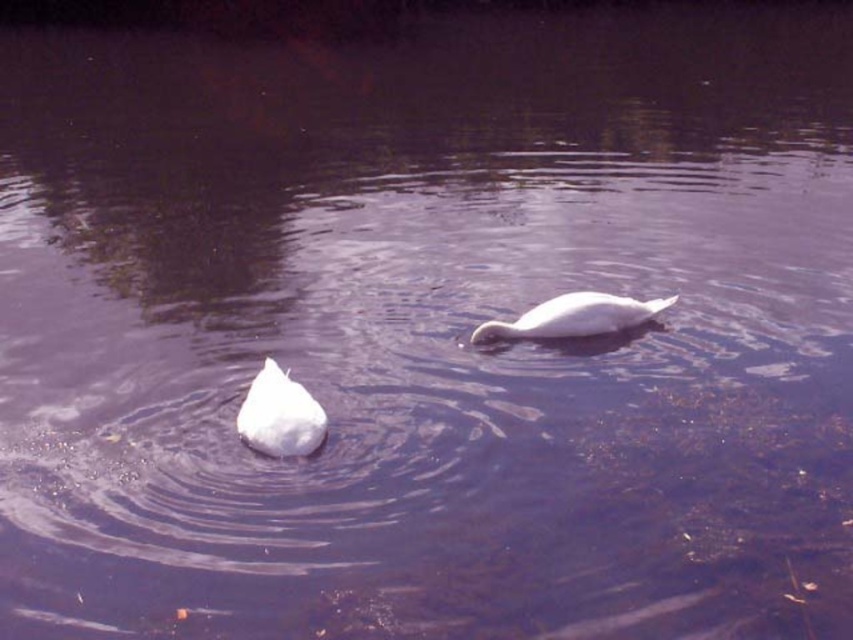
Between white matte swan at lower left and white glossy swan at center, which one has less height?

white glossy swan at center

Between white matte swan at lower left and white glossy swan at center, which one is positioned higher?

white glossy swan at center

The width and height of the screenshot is (853, 640). Find the location of `white matte swan at lower left`. white matte swan at lower left is located at coordinates (279, 416).